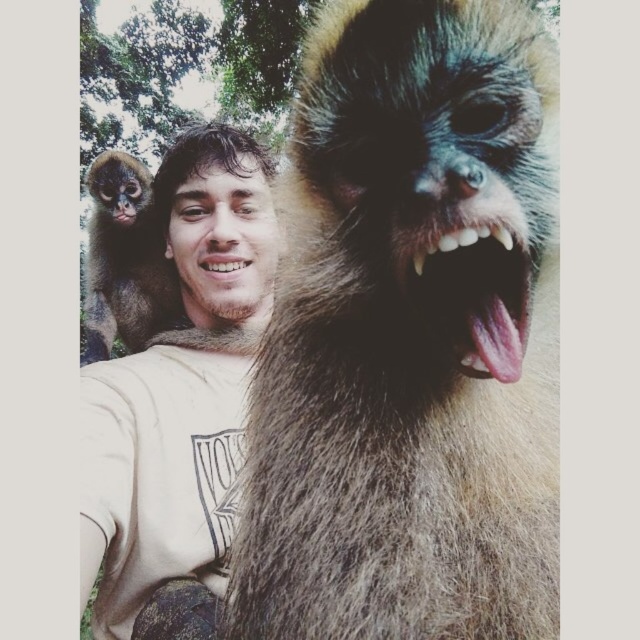
You are a photographer trying to capture a group photo of the fuzzy brown fur monkey at upper left and the brown furry monkey at upper left. If you want to ensure both monkeys are fully visible in the photo, which monkey requires more space in the frame?

The brown furry monkey at upper left requires more space in the frame because its width is greater than the fuzzy brown fur monkey at upper left.

You are a photographer trying to capture a group photo of the fuzzy brown fur monkey at upper left and the brown furry monkey at upper left. Which monkey should you focus on if you want to include both in the frame without cropping either?

The fuzzy brown fur monkey at upper left is shorter than the brown furry monkey at upper left, so focusing on the taller brown furry monkey at upper left would allow both to be included in the frame without cropping.